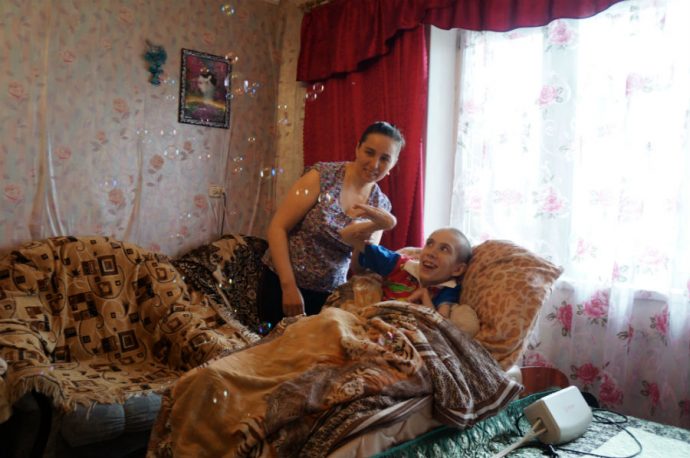
Where is `wallpaper`? wallpaper is located at coordinates (126, 107).